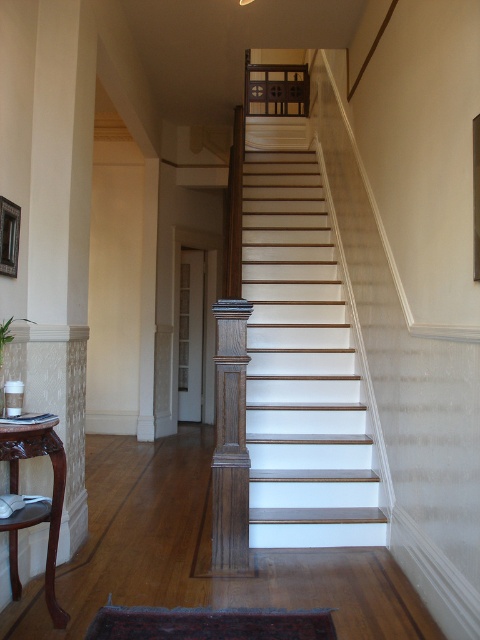
Question: Is brown wood table at lower left above wooden picture frame at upper left?

Choices:
 (A) yes
 (B) no

Answer: (B)

Question: Which point appears closest to the camera in this image?

Choices:
 (A) (297, 397)
 (B) (60, 518)

Answer: (B)

Question: Which object appears farthest from the camera in this image?

Choices:
 (A) wooden picture frame at upper left
 (B) brown wood table at lower left
 (C) white painted wood stairs at center

Answer: (C)

Question: Does brown wood table at lower left have a greater width compared to wooden picture frame at upper left?

Choices:
 (A) no
 (B) yes

Answer: (B)

Question: Which point appears farthest from the camera in this image?

Choices:
 (A) (7, 262)
 (B) (52, 557)
 (C) (324, 516)

Answer: (C)

Question: Can you confirm if white painted wood stairs at center is wider than brown wood table at lower left?

Choices:
 (A) no
 (B) yes

Answer: (B)